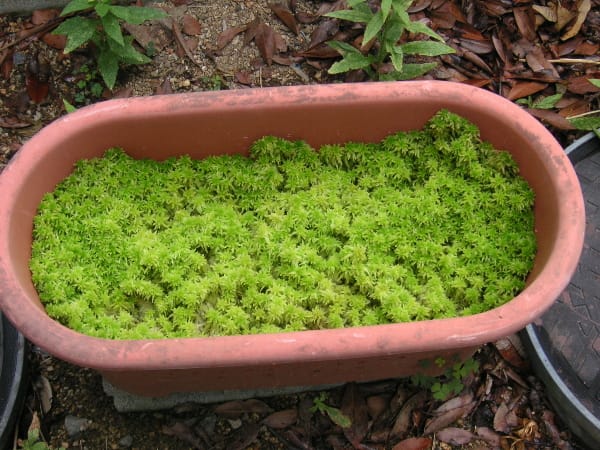
Find the location of a particular element. This screenshot has height=450, width=600. lip of ceramic pot is located at coordinates (566, 257).